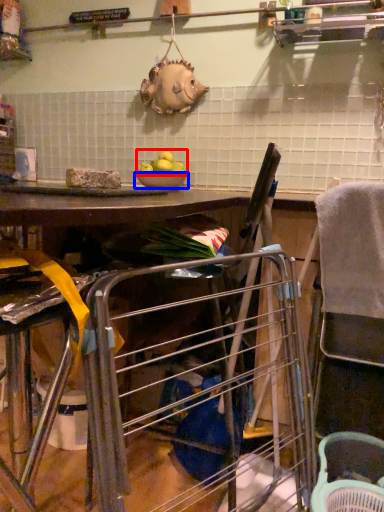
Question: Which object appears farthest to the camera in this image, fruit (highlighted by a red box) or bowl (highlighted by a blue box)?

Choices:
 (A) fruit
 (B) bowl

Answer: (B)